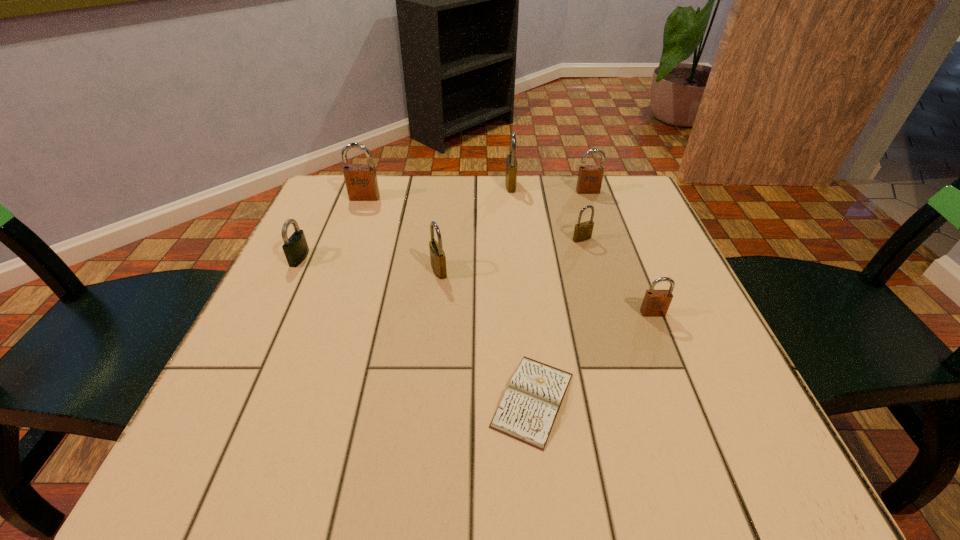
Find the location of a particular element. This screenshot has height=540, width=960. vacant space located 0.270m on the front of the smallest brass padlock is located at coordinates (609, 334).

Locate an element on the screen. The width and height of the screenshot is (960, 540). free spot located 0.140m on the front-facing side of the nearest padlock is located at coordinates (679, 380).

Where is `free space located 0.160m on the right of the diary`? This screenshot has width=960, height=540. free space located 0.160m on the right of the diary is located at coordinates (679, 400).

You are a GUI agent. You are given a task and a screenshot of the screen. Output one action in this format:
    pyautogui.click(x=<x>, y=<y>)
    Task: Click on the object present at the near edge
    Image resolution: width=960 pixels, height=540 pixels.
    Given the screenshot: What is the action you would take?
    pyautogui.click(x=528, y=409)

This screenshot has width=960, height=540. I want to click on object positioned at the far left corner, so click(361, 182).

Identify the location of object located at the far right corner. The image size is (960, 540). (590, 177).

The height and width of the screenshot is (540, 960). Identify the location of vacant position at the far edge of the desktop. (532, 175).

You are a GUI agent. You are given a task and a screenshot of the screen. Output one action in this format:
    pyautogui.click(x=<x>, y=<y>)
    Task: Click on the vacant space at the near edge of the desktop
    The height and width of the screenshot is (540, 960).
    Given the screenshot: What is the action you would take?
    pyautogui.click(x=553, y=471)

Find the location of a particular element. This screenshot has width=960, height=540. vacant space at the left edge of the desktop is located at coordinates (238, 370).

The width and height of the screenshot is (960, 540). I want to click on free space at the right edge of the desktop, so click(x=648, y=265).